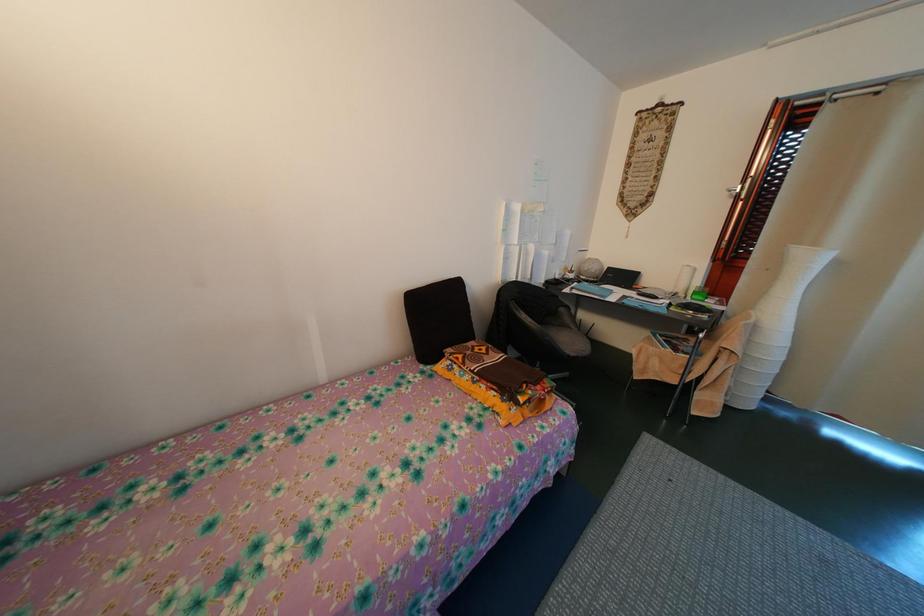
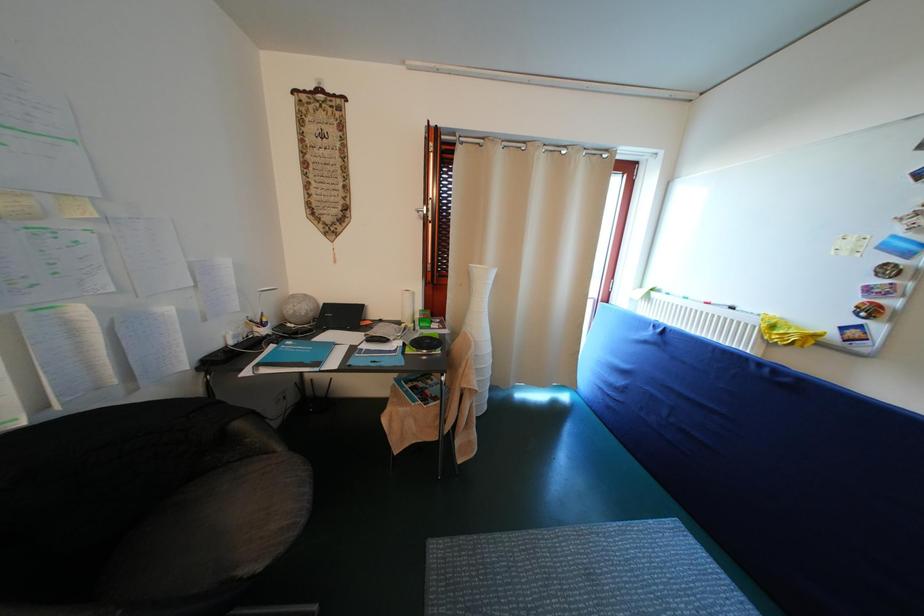
Question: The camera is either moving clockwise (left) or counter-clockwise (right) around the object. The first image is from the beginning of the video and the second image is from the end. Is the camera moving left or right when shooting the video?

Choices:
 (A) Left
 (B) Right

Answer: (A)